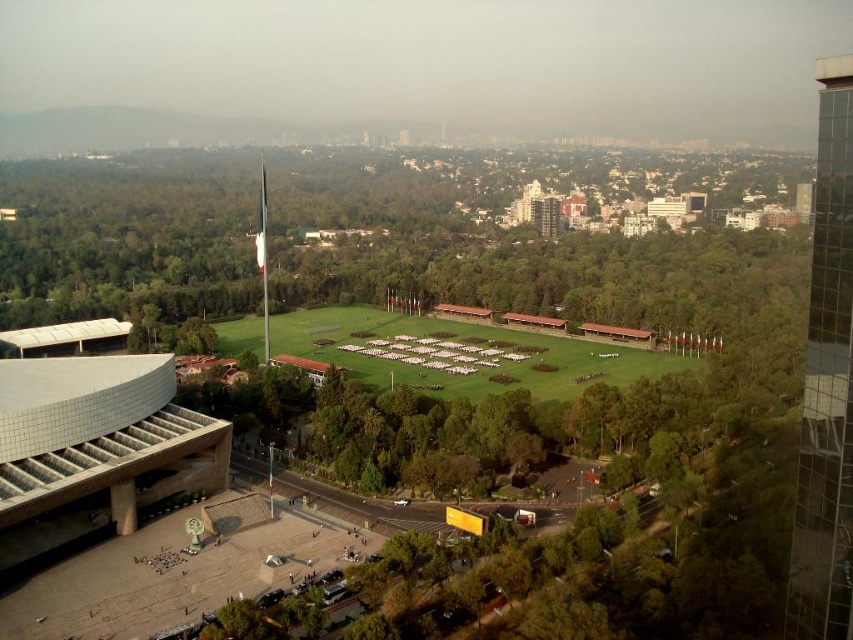
You are a park visitor standing at the edge of the plaza. You see the green leafy tree at center and the green grassy field at center. Which one is higher from the ground?

The green leafy tree at center is above the green grassy field at center, so the green leafy tree at center is higher from the ground.

Looking at this image, you are planning to place a new bench in the park. The bench is 2 meters wide. Which object between the green leafy tree at center and the green grassy field at center can accommodate the bench in terms of width?

The green leafy tree at center has a greater width than the green grassy field at center, so the bench can be placed near the green leafy tree at center as it has sufficient width.

Based on the photo, you are standing in the plaza and want to take a photo of both the sculpture resembling a tree in the center of the plaza and the tall flagpole with the Mexican flag. To ensure both are in frame, should you move closer to or farther from the points labeled point (308,212) and point (383,326)?

Since point (308,212) is closer to the camera than point (383,326), you should move closer to point (308,212) to ensure both the sculpture and the flagpole are in frame.